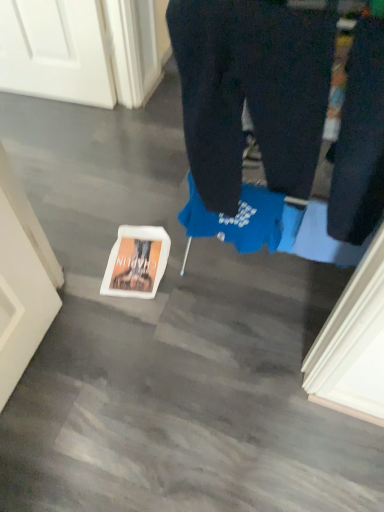
The image size is (384, 512). Describe the element at coordinates (360, 140) in the screenshot. I see `dark blue jeans at right` at that location.

The width and height of the screenshot is (384, 512). In order to click on dark blue jeans at right in this screenshot , I will do [x=360, y=140].

At what (x,y) coordinates should I click in order to perform the action: click on white matte book at lower center. Please return your answer as a coordinate pair (x, y). Looking at the image, I should click on (136, 262).

Find the location of `dark blue jeans at right`. dark blue jeans at right is located at coordinates (360, 140).

Is white matte book at lower center positioned with its back to dark blue jeans at right?

No, white matte book at lower center is not facing away from dark blue jeans at right.

Considering the relative positions of white matte book at lower center and dark blue jeans at right in the image provided, is white matte book at lower center to the left or to the right of dark blue jeans at right?

white matte book at lower center is to the left of dark blue jeans at right.

Considering the positions of point (135, 259) and point (338, 141), is point (135, 259) closer or farther from the camera than point (338, 141)?

Point (135, 259) is farther from the camera than point (338, 141).

From a real-world perspective, does dark blue cotton trousers at center stand above dark blue jeans at right?

No, from a real-world perspective, dark blue cotton trousers at center is not above dark blue jeans at right.

This screenshot has height=512, width=384. I want to click on trousers located on the left of dark blue jeans at right, so click(251, 92).

From the image's perspective, is dark blue cotton trousers at center above or below dark blue jeans at right?

dark blue cotton trousers at center is above dark blue jeans at right.

Are dark blue jeans at right and white matte book at lower center making contact?

No, dark blue jeans at right is not making contact with white matte book at lower center.

Is dark blue jeans at right behind white matte book at lower center?

No, dark blue jeans at right is in front of white matte book at lower center.

Is dark blue jeans at right aimed at white matte book at lower center?

No, dark blue jeans at right does not turn towards white matte book at lower center.

How many degrees apart are the facing directions of dark blue jeans at right and white matte book at lower center?

The angular difference between dark blue jeans at right and white matte book at lower center is 15.6 degrees.

The height and width of the screenshot is (512, 384). I want to click on trousers in front of the white matte book at lower center, so pyautogui.click(x=251, y=92).

From the image's perspective, between white matte book at lower center and dark blue cotton trousers at center, who is located below?

white matte book at lower center, from the image's perspective.

Would you say white matte book at lower center is inside or outside dark blue cotton trousers at center?

white matte book at lower center cannot be found inside dark blue cotton trousers at center.

Is white matte book at lower center turned away from dark blue cotton trousers at center?

No, dark blue cotton trousers at center is not at the back of white matte book at lower center.

From the image's perspective, is dark blue cotton trousers at center on white matte book at lower center?

Yes, from the image's perspective, dark blue cotton trousers at center is on top of white matte book at lower center.

Considering the sizes of objects dark blue cotton trousers at center and white matte book at lower center in the image provided, who is thinner, dark blue cotton trousers at center or white matte book at lower center?

With smaller width is dark blue cotton trousers at center.

Based on the photo, is dark blue cotton trousers at center turned away from white matte book at lower center?

dark blue cotton trousers at center is not turned away from white matte book at lower center.

Who is smaller, dark blue cotton trousers at center or white matte book at lower center?

white matte book at lower center is smaller.

Looking at this image, is dark blue jeans at right touching dark blue cotton trousers at center?

dark blue jeans at right and dark blue cotton trousers at center are not in contact.

Is point (351, 230) closer or farther from the camera than point (215, 123)?

Point (351, 230) appears to be farther away from the viewer than point (215, 123).

You are a GUI agent. You are given a task and a screenshot of the screen. Output one action in this format:
    pyautogui.click(x=<x>, y=<y>)
    Task: Click on the pants on the right of the dark blue cotton trousers at center
    
    Given the screenshot: What is the action you would take?
    pyautogui.click(x=360, y=140)

Between dark blue jeans at right and dark blue cotton trousers at center, which one has larger size?

Bigger between the two is dark blue cotton trousers at center.

At what (x,y) coordinates should I click in order to perform the action: click on pants lying above the white matte book at lower center (from the image's perspective). Please return your answer as a coordinate pair (x, y). Image resolution: width=384 pixels, height=512 pixels. Looking at the image, I should click on (360, 140).

This screenshot has height=512, width=384. Find the location of `pants lying on the right of dark blue cotton trousers at center`. pants lying on the right of dark blue cotton trousers at center is located at coordinates (360, 140).

When comparing their distances from white matte book at lower center, does dark blue jeans at right or dark blue cotton trousers at center seem further?

dark blue jeans at right is positioned further to the anchor white matte book at lower center.

Considering their positions, is dark blue cotton trousers at center positioned further to white matte book at lower center than dark blue jeans at right?

dark blue jeans at right lies further to white matte book at lower center than the other object.

Looking at the image, which one is located further to dark blue cotton trousers at center, dark blue jeans at right or white matte book at lower center?

white matte book at lower center lies further to dark blue cotton trousers at center than the other object.

From the image, which object appears to be farther from dark blue jeans at right, white matte book at lower center or dark blue cotton trousers at center?

white matte book at lower center is further to dark blue jeans at right.

When comparing their distances from dark blue cotton trousers at center, does white matte book at lower center or dark blue jeans at right seem further?

white matte book at lower center.

Looking at the image, which one is located closer to dark blue jeans at right, dark blue cotton trousers at center or white matte book at lower center?

Based on the image, dark blue cotton trousers at center appears to be nearer to dark blue jeans at right.

I want to click on trousers between dark blue jeans at right and white matte book at lower center from front to back, so click(x=251, y=92).